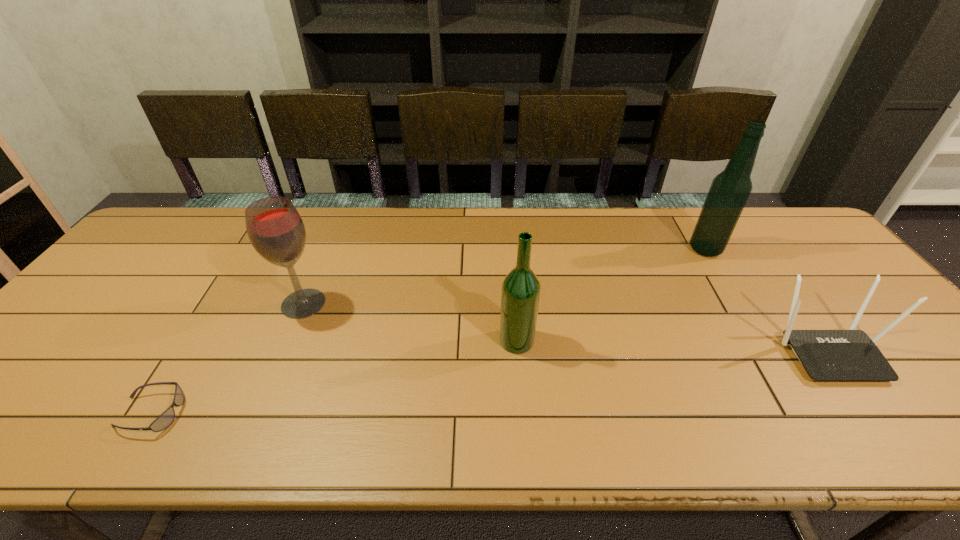
You are a GUI agent. You are given a task and a screenshot of the screen. Output one action in this format:
    pyautogui.click(x=<x>, y=<y>)
    Task: Click on the empty location between the second alcohol from left to right and the second nearest alcohol
    This screenshot has width=960, height=540.
    Given the screenshot: What is the action you would take?
    pyautogui.click(x=410, y=322)

You are a GUI agent. You are given a task and a screenshot of the screen. Output one action in this format:
    pyautogui.click(x=<x>, y=<y>)
    Task: Click on the blank region between the nearest alcohol and the farthest alcohol
    The height and width of the screenshot is (540, 960).
    Given the screenshot: What is the action you would take?
    pyautogui.click(x=611, y=295)

Locate which object ranks third in proximity to the nearest alcohol. Please provide its 2D coordinates. Your answer should be formatted as a tuple, i.e. [(x, y)], where the tuple contains the x and y coordinates of a point satisfying the conditions above.

[(730, 189)]

Choose which object is the third nearest neighbor to the leftmost alcohol. Please provide its 2D coordinates. Your answer should be formatted as a tuple, i.e. [(x, y)], where the tuple contains the x and y coordinates of a point satisfying the conditions above.

[(730, 189)]

Choose which alcohol is the second nearest neighbor to the second nearest alcohol. Please provide its 2D coordinates. Your answer should be formatted as a tuple, i.e. [(x, y)], where the tuple contains the x and y coordinates of a point satisfying the conditions above.

[(730, 189)]

This screenshot has width=960, height=540. In order to click on the closest alcohol to the nearest alcohol in this screenshot , I will do click(275, 229).

Locate an element on the screen. vacant space that satisfies the following two spatial constraints: 1. on the front side of the second farthest alcohol; 2. on the right side of the second alcohol from right to left is located at coordinates (288, 341).

Where is `free space that satisfies the following two spatial constraints: 1. on the front-facing side of the router; 2. on the lenses of the sunglasses`? free space that satisfies the following two spatial constraints: 1. on the front-facing side of the router; 2. on the lenses of the sunglasses is located at coordinates (874, 413).

The image size is (960, 540). In order to click on free point that satisfies the following two spatial constraints: 1. on the back side of the tallest object; 2. on the left side of the nearest alcohol in this screenshot , I will do `click(510, 249)`.

I want to click on free space in the image that satisfies the following two spatial constraints: 1. on the back side of the farthest object; 2. on the left side of the nearest alcohol, so click(x=510, y=249).